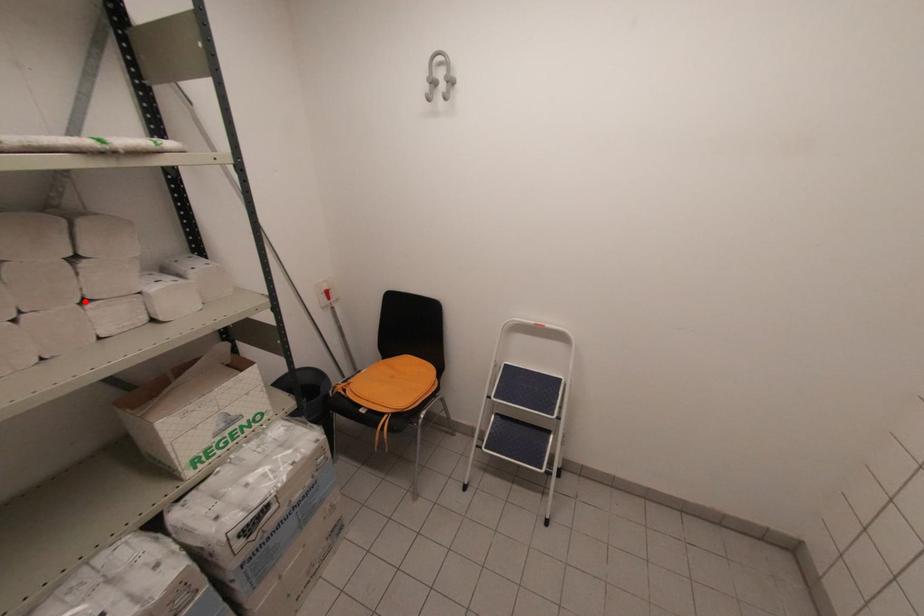
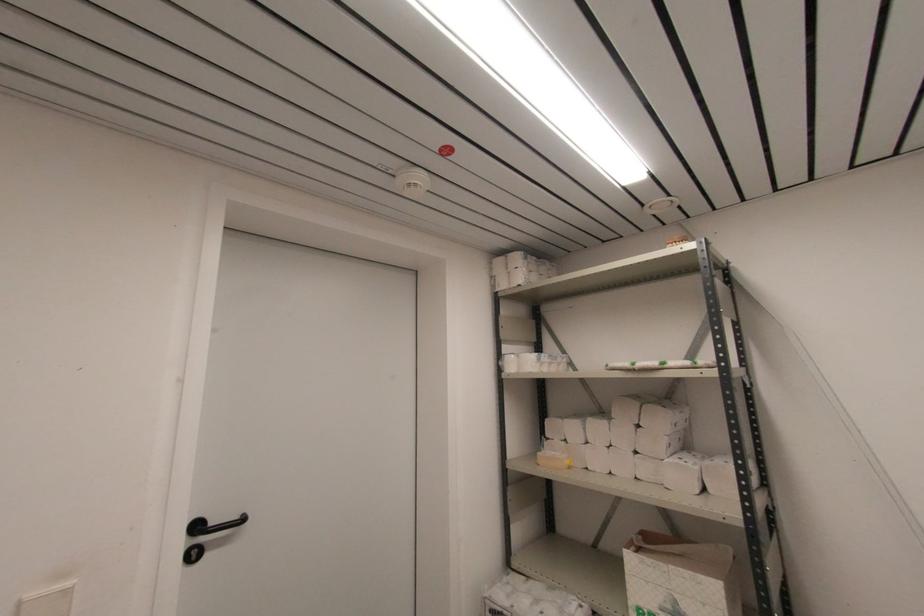
Find the pixel in the second image that matches the highlighted location in the first image.

(637, 453)